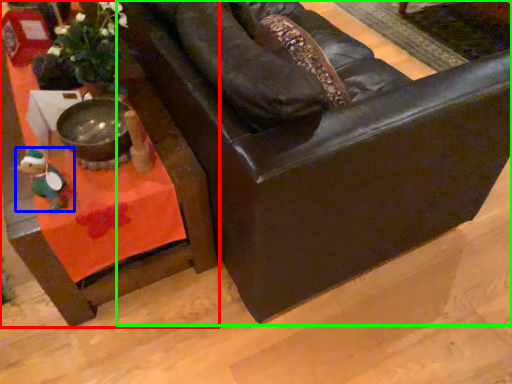
Question: Estimate the real-world distances between objects in this image. Which object is farther from table (highlighted by a red box), toy (highlighted by a blue box) or chair (highlighted by a green box)?

Choices:
 (A) toy
 (B) chair

Answer: (B)